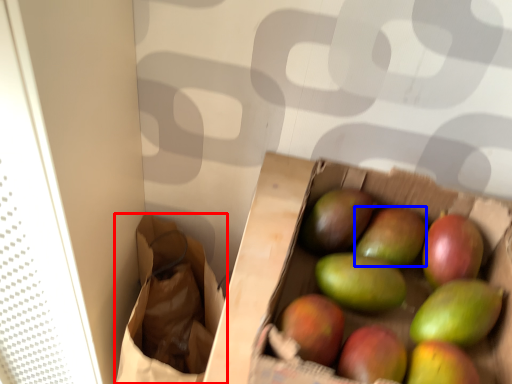
Question: Which of the following is the farthest to the observer, shopping bag (highlighted by a red box) or apple (highlighted by a blue box)?

Choices:
 (A) shopping bag
 (B) apple

Answer: (A)